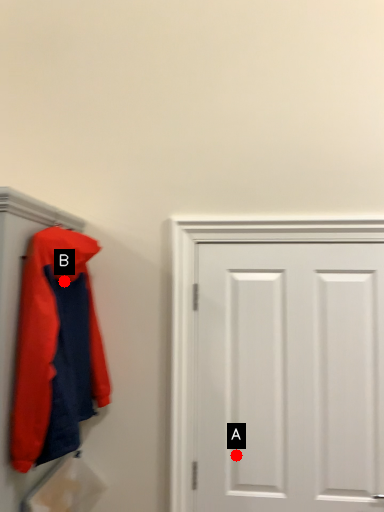
Question: Two points are circled on the image, labeled by A and B beside each circle. Which of the following is the farthest from the observer?

Choices:
 (A) A is further
 (B) B is further

Answer: (A)